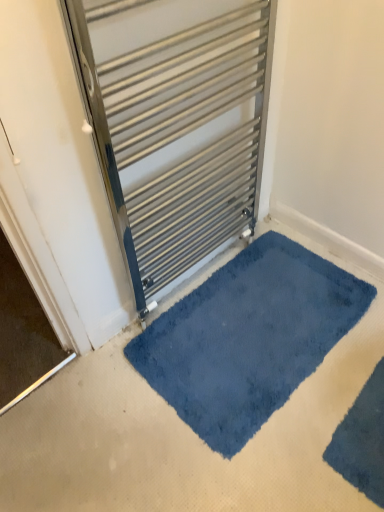
Where is `vacant space behind velvety blue bath mat at lower right, positioned as the 2th bath mat in back-to-front order`? vacant space behind velvety blue bath mat at lower right, positioned as the 2th bath mat in back-to-front order is located at coordinates pos(321,352).